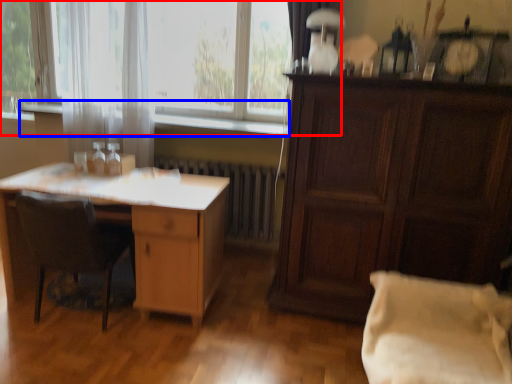
Question: Which object is further to the camera taking this photo, window (highlighted by a red box) or window sill (highlighted by a blue box)?

Choices:
 (A) window
 (B) window sill

Answer: (A)